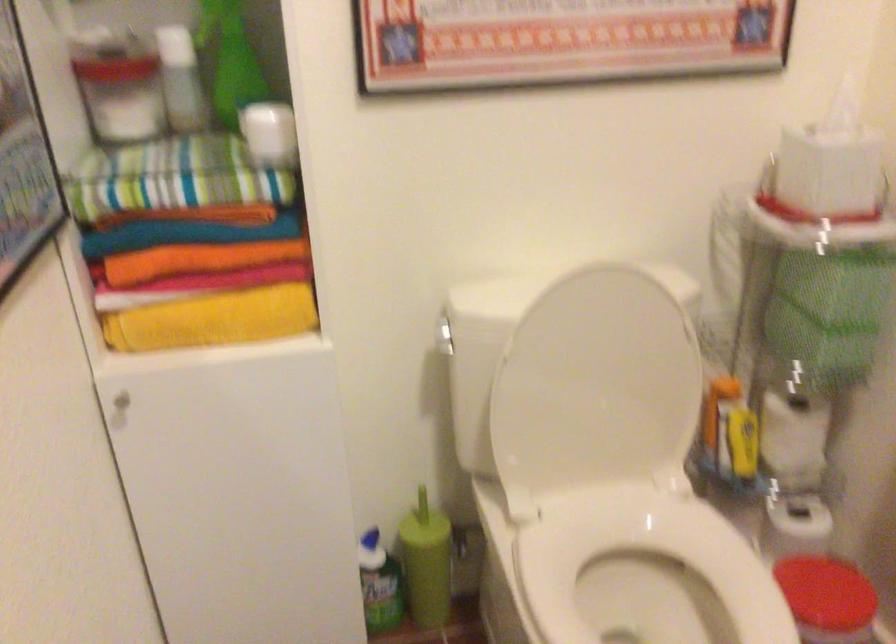
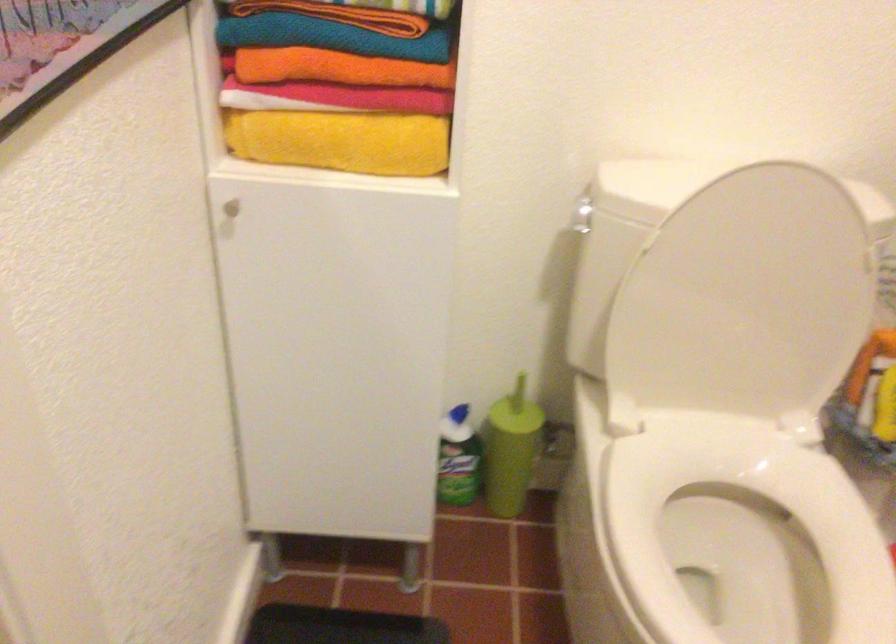
The point at (201, 259) is marked in the first image. Where is the corresponding point in the second image?

(339, 68)